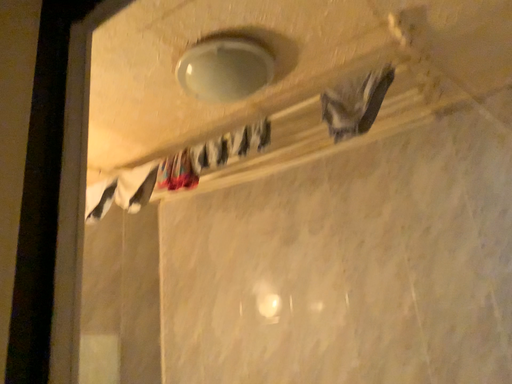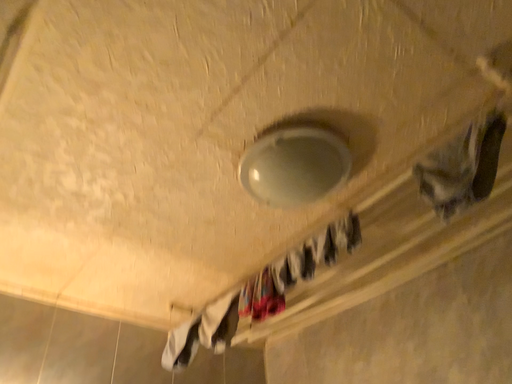
Question: How did the camera likely rotate when shooting the video?

Choices:
 (A) rotated downward
 (B) rotated upward

Answer: (B)